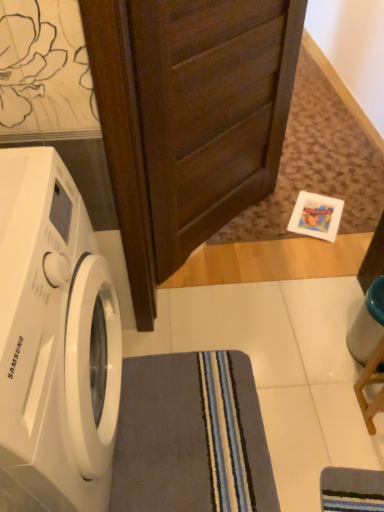
Where is `vacant region above gray soft rug at lower center (from a real-world perspective)`? Image resolution: width=384 pixels, height=512 pixels. vacant region above gray soft rug at lower center (from a real-world perspective) is located at coordinates (193, 436).